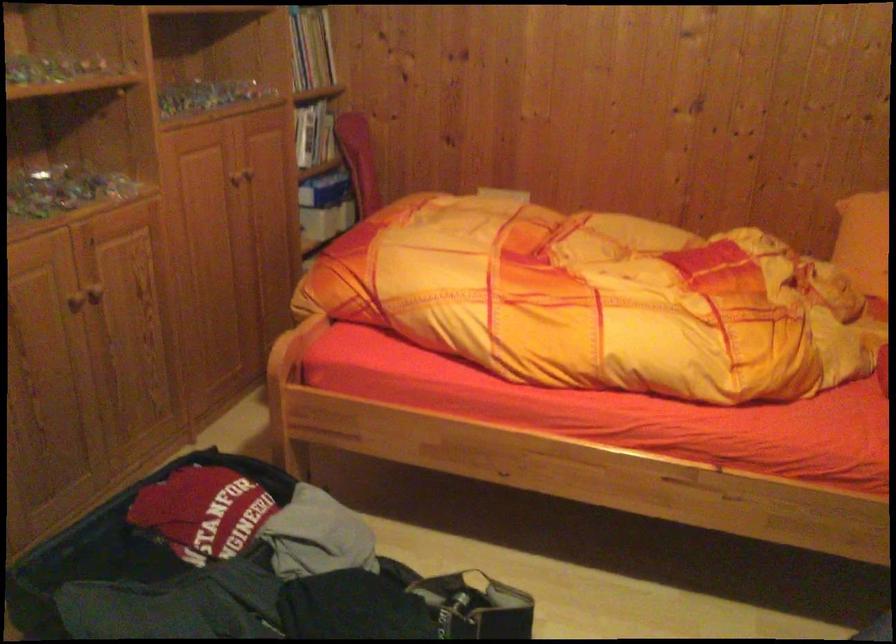
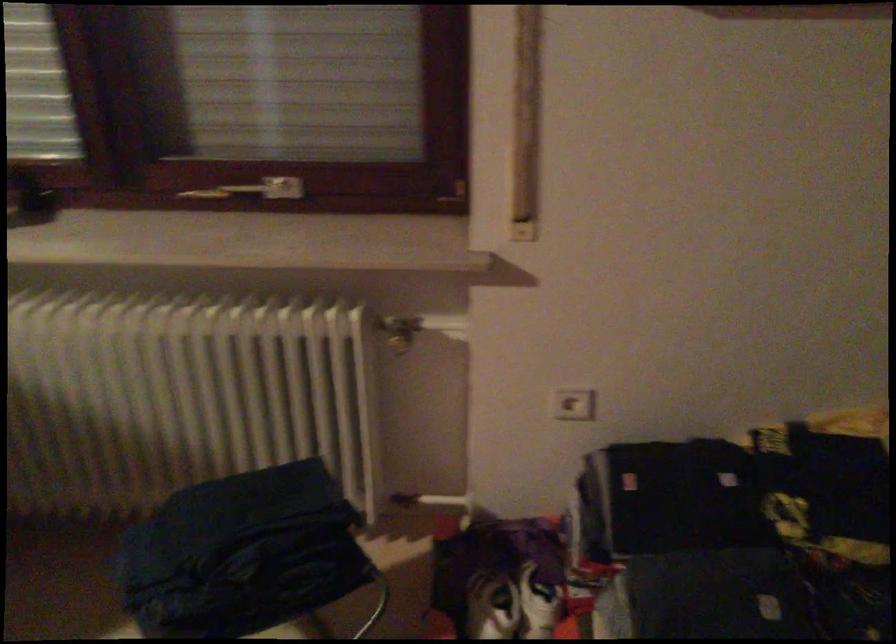
Based on the continuous images, in which direction is the camera rotating?

The camera's rotation is toward right-down.